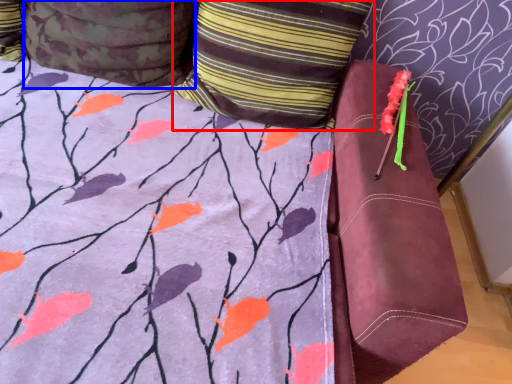
Question: Which of the following is the closest to the observer, pillow (highlighted by a red box) or pillow (highlighted by a blue box)?

Choices:
 (A) pillow
 (B) pillow

Answer: (B)